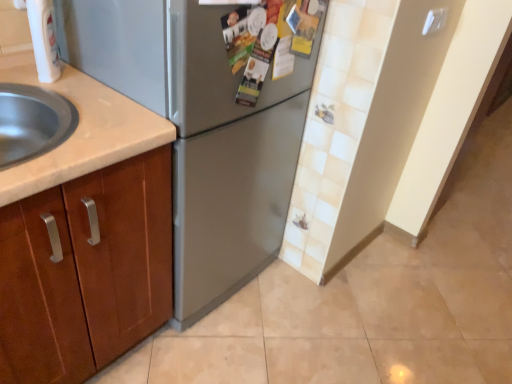
Question: Should I look upward or downward to see satin silver refrigerator at center?

Choices:
 (A) down
 (B) up

Answer: (B)

Question: Is satin silver refrigerator at center taller than white plastic faucet at upper left?

Choices:
 (A) yes
 (B) no

Answer: (A)

Question: Is satin silver refrigerator at center located outside white plastic faucet at upper left?

Choices:
 (A) no
 (B) yes

Answer: (B)

Question: Is satin silver refrigerator at center shorter than white plastic faucet at upper left?

Choices:
 (A) no
 (B) yes

Answer: (A)

Question: Considering the relative sizes of satin silver refrigerator at center and white plastic faucet at upper left in the image provided, is satin silver refrigerator at center thinner than white plastic faucet at upper left?

Choices:
 (A) no
 (B) yes

Answer: (A)

Question: Considering the relative sizes of satin silver refrigerator at center and white plastic faucet at upper left in the image provided, is satin silver refrigerator at center wider than white plastic faucet at upper left?

Choices:
 (A) yes
 (B) no

Answer: (A)

Question: Can you confirm if satin silver refrigerator at center is bigger than white plastic faucet at upper left?

Choices:
 (A) yes
 (B) no

Answer: (A)

Question: From the image's perspective, is white plastic faucet at upper left under satin silver refrigerator at center?

Choices:
 (A) no
 (B) yes

Answer: (A)

Question: Does white plastic faucet at upper left come behind satin silver refrigerator at center?

Choices:
 (A) yes
 (B) no

Answer: (A)

Question: From a real-world perspective, is white plastic faucet at upper left located beneath satin silver refrigerator at center?

Choices:
 (A) yes
 (B) no

Answer: (B)

Question: Considering the relative sizes of white plastic faucet at upper left and satin silver refrigerator at center in the image provided, is white plastic faucet at upper left bigger than satin silver refrigerator at center?

Choices:
 (A) no
 (B) yes

Answer: (A)

Question: Are white plastic faucet at upper left and satin silver refrigerator at center located far from each other?

Choices:
 (A) yes
 (B) no

Answer: (B)

Question: From the image's perspective, is white plastic faucet at upper left over satin silver refrigerator at center?

Choices:
 (A) no
 (B) yes

Answer: (B)

Question: Is satin silver refrigerator at center wider or thinner than white plastic faucet at upper left?

Choices:
 (A) thin
 (B) wide

Answer: (B)